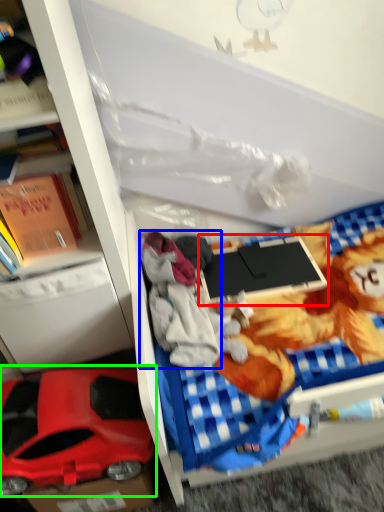
Question: Considering the real-world distances, which object is closest to laptop (highlighted by a red box)? clothing (highlighted by a blue box) or car (highlighted by a green box).

Choices:
 (A) clothing
 (B) car

Answer: (A)